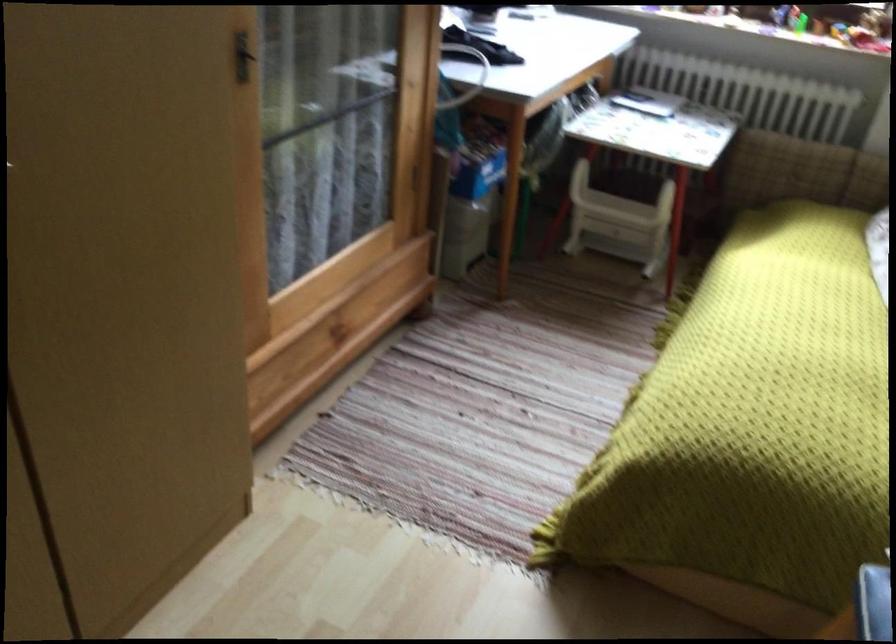
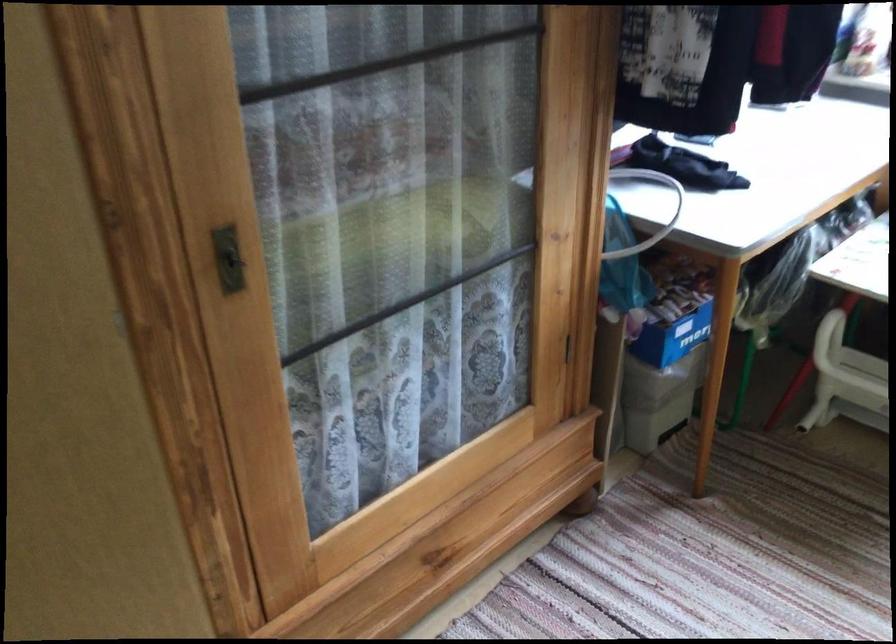
Question: The first image is from the beginning of the video and the second image is from the end. How did the camera likely rotate when shooting the video?

Choices:
 (A) Left
 (B) Right
 (C) Up
 (D) Down

Answer: (A)